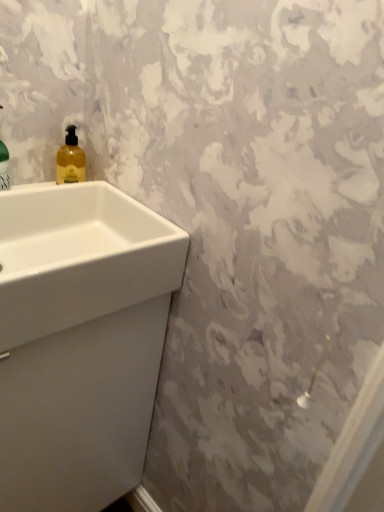
Question: Is white glossy sink at lower left, the first sink when ordered from bottom to top, not near yellow translucent liquid at upper left?

Choices:
 (A) yes
 (B) no

Answer: (B)

Question: From a real-world perspective, is white glossy sink at lower left, the second sink viewed from the top, physically above yellow translucent liquid at upper left?

Choices:
 (A) no
 (B) yes

Answer: (A)

Question: Is yellow translucent liquid at upper left a part of white glossy sink at lower left, the first sink when ordered from bottom to top?

Choices:
 (A) no
 (B) yes

Answer: (A)

Question: Can you confirm if white glossy sink at lower left, the second sink viewed from the top, is smaller than yellow translucent liquid at upper left?

Choices:
 (A) yes
 (B) no

Answer: (B)

Question: Is white glossy sink at lower left, the second sink viewed from the top, shorter than yellow translucent liquid at upper left?

Choices:
 (A) yes
 (B) no

Answer: (B)

Question: Does point (77, 180) appear closer or farther from the camera than point (89, 288)?

Choices:
 (A) closer
 (B) farther

Answer: (B)

Question: Choose the correct answer: Is yellow translucent liquid at upper left inside white glossy sink at lower left, the first sink when ordered from bottom to top, or outside it?

Choices:
 (A) outside
 (B) inside

Answer: (A)

Question: Would you say yellow translucent liquid at upper left is to the left or to the right of white glossy sink at lower left, the second sink viewed from the top, in the picture?

Choices:
 (A) left
 (B) right

Answer: (B)

Question: In terms of height, does yellow translucent liquid at upper left look taller or shorter compared to white glossy sink at lower left, the second sink viewed from the top?

Choices:
 (A) short
 (B) tall

Answer: (A)

Question: Visually, is white glossy sink at left, acting as the second sink starting from the bottom, positioned to the left or to the right of white glossy sink at lower left, the second sink viewed from the top?

Choices:
 (A) left
 (B) right

Answer: (B)

Question: In terms of height, does white glossy sink at left, acting as the second sink starting from the bottom, look taller or shorter compared to white glossy sink at lower left, the second sink viewed from the top?

Choices:
 (A) tall
 (B) short

Answer: (B)

Question: Based on their sizes in the image, would you say white glossy sink at left, the first sink in the top-to-bottom sequence, is bigger or smaller than white glossy sink at lower left, the first sink when ordered from bottom to top?

Choices:
 (A) big
 (B) small

Answer: (B)

Question: Is white glossy sink at left, the first sink in the top-to-bottom sequence, in front of or behind white glossy sink at lower left, the second sink viewed from the top, in the image?

Choices:
 (A) front
 (B) behind

Answer: (A)

Question: Is white glossy sink at lower left, the second sink viewed from the top, in front of or behind yellow translucent liquid at upper left in the image?

Choices:
 (A) behind
 (B) front

Answer: (B)

Question: In terms of width, does white glossy sink at lower left, the first sink when ordered from bottom to top, look wider or thinner when compared to yellow translucent liquid at upper left?

Choices:
 (A) thin
 (B) wide

Answer: (B)